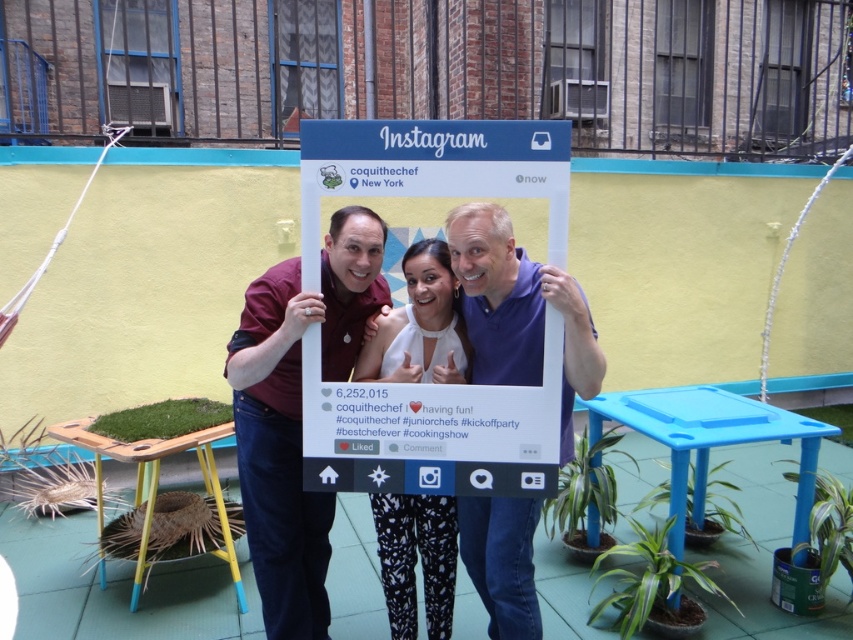
You are a photographer trying to capture a photo of the matte white frame at center and the white printed pants at center. Which object is wider?

The matte white frame at center is wider than the white printed pants at center.